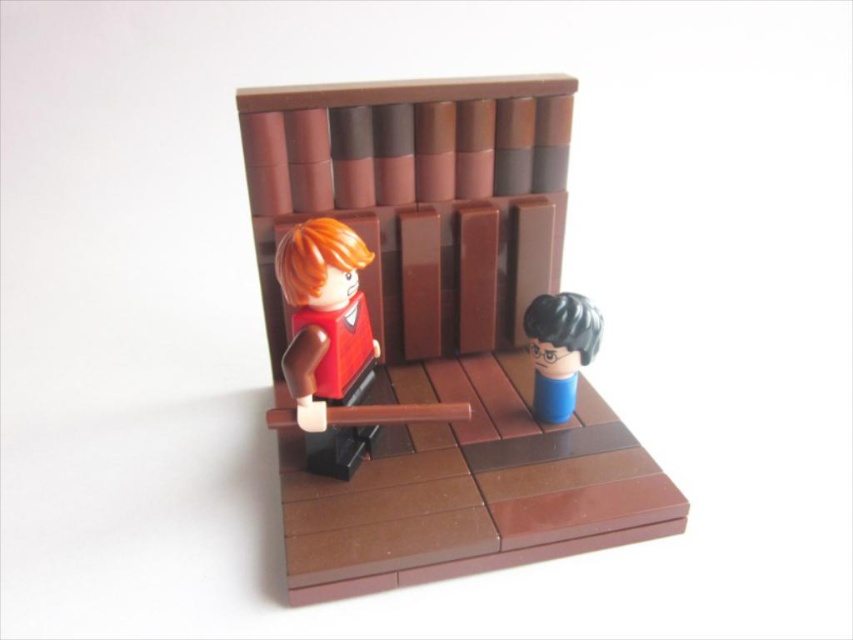
You are a LEGO designer trying to place a new accessory between the smooth red shirt at center and the blue matte head at center. Since you want the accessory to fit snugly between them, which object should you measure to ensure the accessory won,t be too large?

You should measure the space between the smooth red shirt at center and the blue matte head at center. Since the smooth red shirt at center is bigger than the blue matte head at center, the accessory should be sized to fit the smaller space near the blue matte head at center to ensure it won,t be too large.

You are a LEGO designer observing the diorama. You need to determine if a small LEGO accessory that is 2 cm tall can be placed between the matte orange hair at left and the blue matte head at center without being hidden. Based on their heights, can the accessory be placed there?

The matte orange hair at left is taller than the blue matte head at center. Since the accessory is 2 cm tall, it can be placed between them as long as its height does not exceed the shorter object. However, since the blue matte head at center is shorter, the accessory must be shorter than it to remain visible. If the accessory is 2 cm and the blue matte head is shorter than 2 cm, it might be hidden. But without exact measurements, we can infer that placing it near the shorter object could hide it. Therefore

Consider the image. You are standing in front of the LEGO diorama and want to know how far the point at coordinates (360, 92) is from you. Can you determine the distance?

The point at coordinates (360, 92) is 3.60 feet away from the viewer.